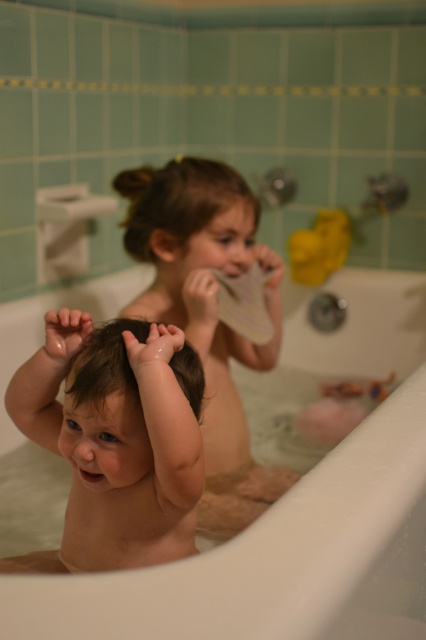
Can you confirm if smooth skin baby at center is smaller than smooth skin child at center?

Indeed, smooth skin baby at center has a smaller size compared to smooth skin child at center.

Find the location of `smooth skin baby at center`. smooth skin baby at center is located at coordinates (117, 436).

What are the coordinates of `smooth skin baby at center` in the screenshot? It's located at (117, 436).

Does smooth white bathtub at center have a greater width compared to smooth skin child at center?

In fact, smooth white bathtub at center might be narrower than smooth skin child at center.

Can you confirm if smooth white bathtub at center is smaller than smooth skin child at center?

Correct, smooth white bathtub at center occupies less space than smooth skin child at center.

Does point (77, 589) come farther from viewer compared to point (206, 308)?

No, (77, 589) is closer to viewer.

The image size is (426, 640). Find the location of `smooth white bathtub at center`. smooth white bathtub at center is located at coordinates (278, 502).

Where is `smooth white bathtub at center`? smooth white bathtub at center is located at coordinates (278, 502).

Is smooth white bathtub at center smaller than smooth skin baby at center?

Yes, smooth white bathtub at center is smaller than smooth skin baby at center.

The height and width of the screenshot is (640, 426). I want to click on smooth white bathtub at center, so click(278, 502).